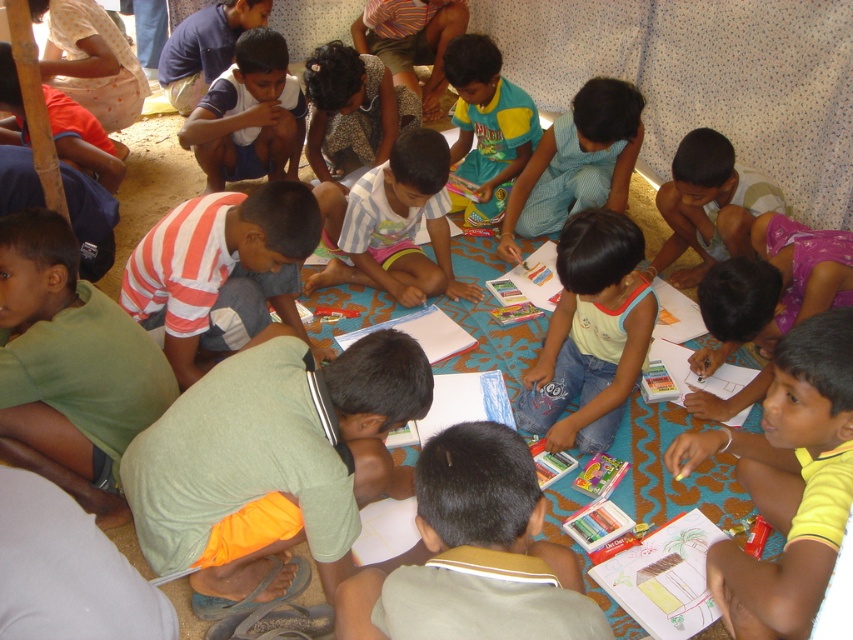
Question: Based on their relative distances, which object is farther from the light blue denim pants at center?

Choices:
 (A) green matte shirt at left
 (B) striped fabric shirt at center
 (C) green fabric shirt at lower left
 (D) teal jersey at center

Answer: (A)

Question: Estimate the real-world distances between objects in this image. Which object is farther from the patterned fabric shirt at center?

Choices:
 (A) teal jersey at center
 (B) white cotton shirt at center
 (C) white striped shirt at center

Answer: (C)

Question: Does yellow cotton shirt at center appear on the left side of patterned fabric shirt at center?

Choices:
 (A) yes
 (B) no

Answer: (B)

Question: Can you confirm if yellow cotton shirt at center is bigger than teal jersey at center?

Choices:
 (A) yes
 (B) no

Answer: (B)

Question: Does yellow cotton shirt at center appear on the right side of white cotton shirt at center?

Choices:
 (A) no
 (B) yes

Answer: (B)

Question: Which object is closer to the camera taking this photo?

Choices:
 (A) yellow cotton shirt at center
 (B) light blue denim pants at center
 (C) matte green shirt at center
 (D) white striped shirt at center

Answer: (C)